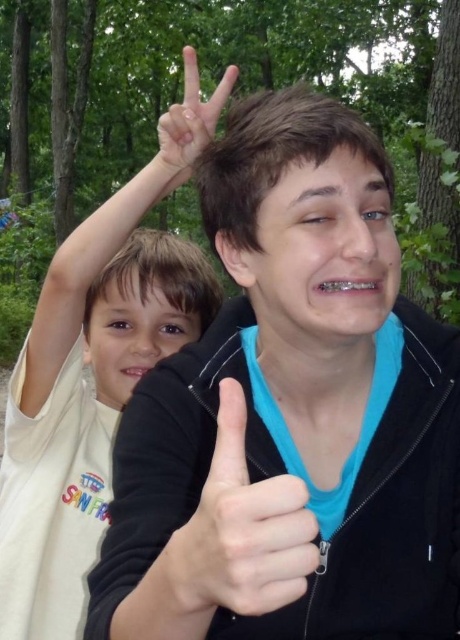
Question: Is the position of smooth skin thumb up at center more distant than that of white matte hand at upper center?

Choices:
 (A) no
 (B) yes

Answer: (A)

Question: Is black matte jacket at center to the right of light beige shirt at upper left from the viewer's perspective?

Choices:
 (A) no
 (B) yes

Answer: (B)

Question: Which of the following is the farthest from the observer?

Choices:
 (A) black matte jacket at center
 (B) light beige shirt at upper left
 (C) smooth skin thumb up at center

Answer: (B)

Question: Is light beige shirt at upper left positioned behind white matte hand at upper center?

Choices:
 (A) yes
 (B) no

Answer: (B)

Question: Which object is closer to the camera taking this photo?

Choices:
 (A) black matte jacket at center
 (B) smooth skin thumb up at center
 (C) light beige shirt at upper left
 (D) white matte hand at upper center

Answer: (A)

Question: Which object is positioned farthest from the white matte hand at upper center?

Choices:
 (A) smooth skin thumb up at center
 (B) light beige shirt at upper left
 (C) black matte jacket at center

Answer: (A)